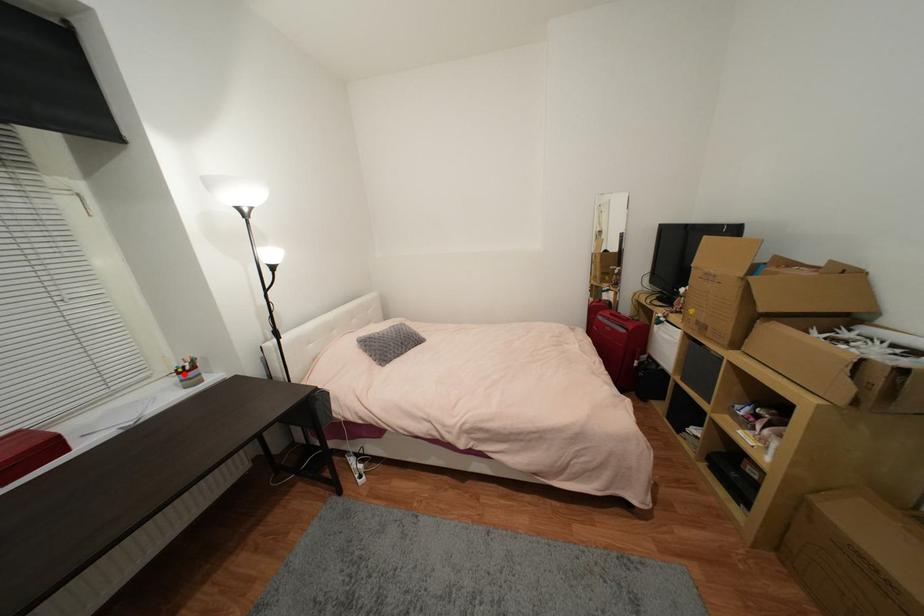
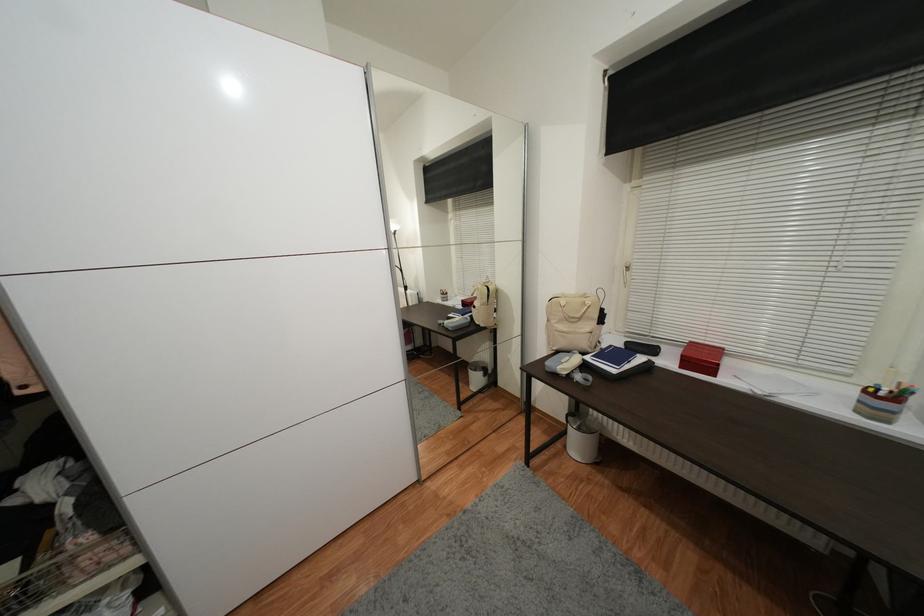
Where in the second image is the point corresponding to the highlighted location from the first image?

(871, 392)